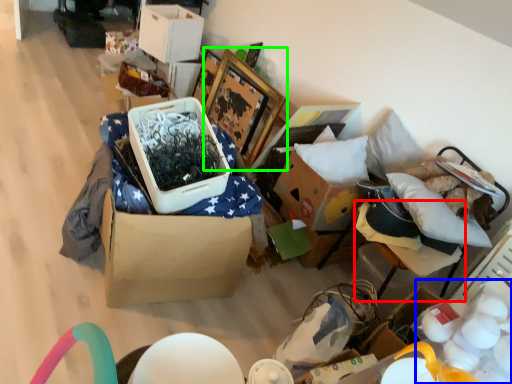
Question: Based on their relative distances, which object is nearer to furniture (highlighted by a red box)? Choose from egg (highlighted by a blue box) and picture frame (highlighted by a green box).

Choices:
 (A) egg
 (B) picture frame

Answer: (A)